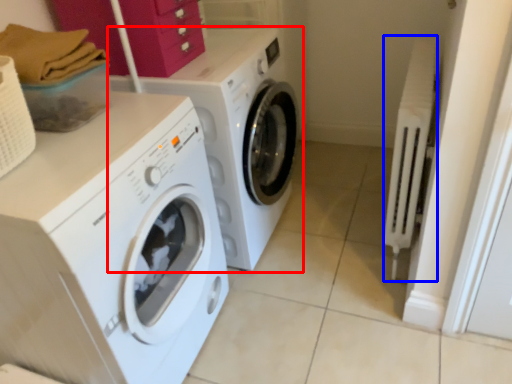
Question: Which point is further to the camera, washing machine (highlighted by a red box) or radiator (highlighted by a blue box)?

Choices:
 (A) washing machine
 (B) radiator

Answer: (A)